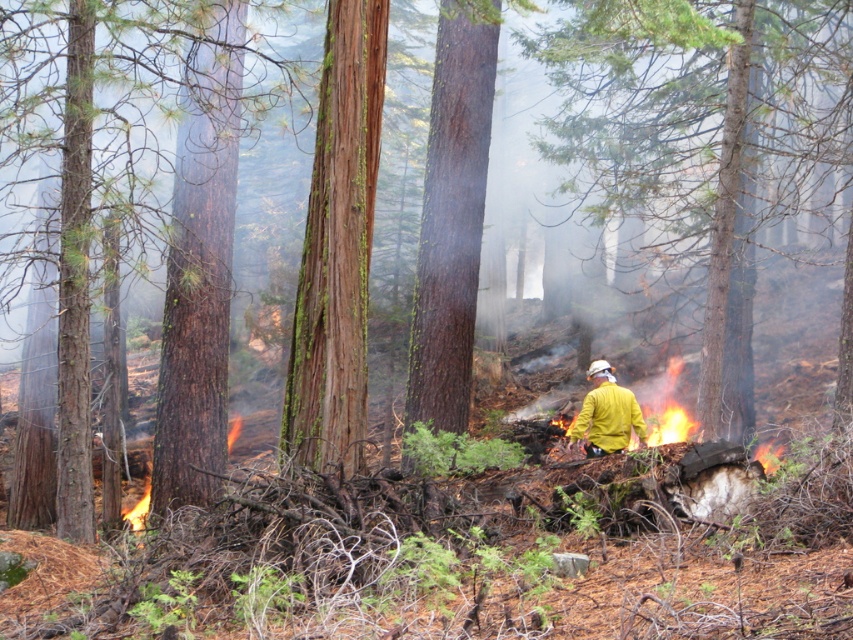
Question: Is smooth bark tree at center to the left of flame wood fire at lower left from the viewer's perspective?

Choices:
 (A) yes
 (B) no

Answer: (B)

Question: Which is farther from the green mossy bark tree at center?

Choices:
 (A) smooth bark tree at center
 (B) flame wood fire at lower left

Answer: (A)

Question: Does smooth bark tree at center have a lesser width compared to yellow matte jacket at center?

Choices:
 (A) no
 (B) yes

Answer: (A)

Question: Which of these objects is positioned closest to the green mossy bark tree at center?

Choices:
 (A) flame wood fire at lower left
 (B) yellow matte jacket at center
 (C) smooth bark tree at center

Answer: (B)

Question: Which point is farther to the camera?

Choices:
 (A) (131, 515)
 (B) (366, 170)
 (C) (596, 394)

Answer: (A)

Question: Can you confirm if green mossy bark tree at center is positioned above yellow matte jacket at center?

Choices:
 (A) no
 (B) yes

Answer: (B)